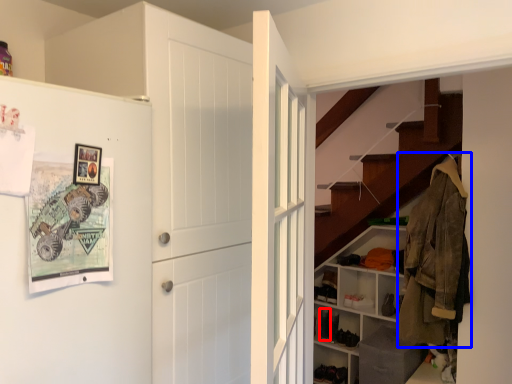
Question: Among these objects, which one is farthest to the camera, shoe (highlighted by a red box) or clothing (highlighted by a blue box)?

Choices:
 (A) shoe
 (B) clothing

Answer: (A)